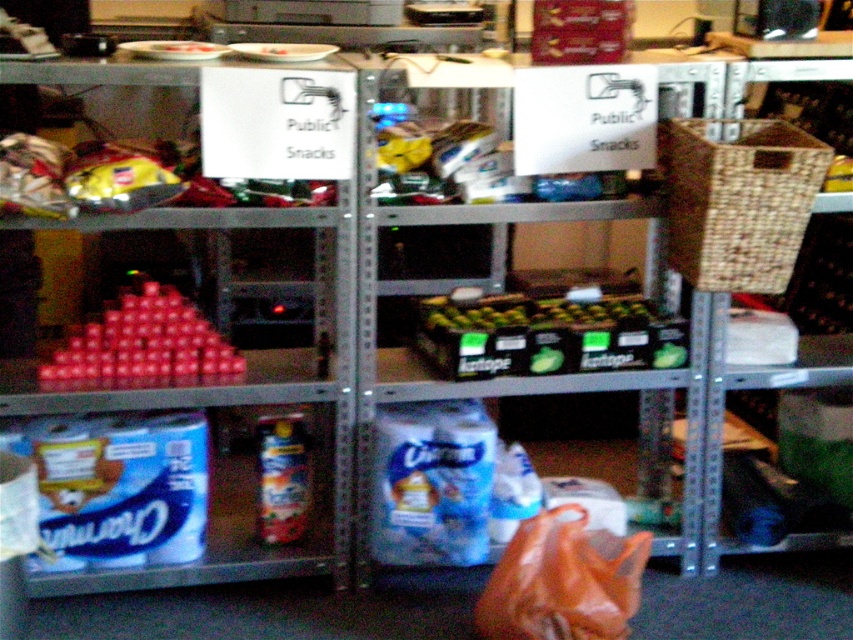
Can you confirm if orange plastic bag at lower center is positioned to the right of blue cardboard charmin at lower left?

Yes, orange plastic bag at lower center is to the right of blue cardboard charmin at lower left.

You are a GUI agent. You are given a task and a screenshot of the screen. Output one action in this format:
    pyautogui.click(x=<x>, y=<y>)
    Task: Click on the orange plastic bag at lower center
    This screenshot has height=640, width=853.
    Given the screenshot: What is the action you would take?
    pyautogui.click(x=561, y=580)

At what (x,y) coordinates should I click in order to perform the action: click on orange plastic bag at lower center. Please return your answer as a coordinate pair (x, y). The image size is (853, 640). Looking at the image, I should click on (561, 580).

I want to click on orange plastic bag at lower center, so click(x=561, y=580).

Which is in front, point (635, 582) or point (148, 374)?

Point (635, 582) is more forward.

Is orange plastic bag at lower center shorter than matte plastic cups at left?

In fact, orange plastic bag at lower center may be taller than matte plastic cups at left.

This screenshot has height=640, width=853. Describe the element at coordinates (561, 580) in the screenshot. I see `orange plastic bag at lower center` at that location.

This screenshot has width=853, height=640. What are the coordinates of `orange plastic bag at lower center` in the screenshot? It's located at (561, 580).

Does blue cardboard charmin at lower left have a smaller size compared to matte plastic cups at left?

No, blue cardboard charmin at lower left is not smaller than matte plastic cups at left.

Does blue cardboard charmin at lower left have a greater width compared to matte plastic cups at left?

Indeed, blue cardboard charmin at lower left has a greater width compared to matte plastic cups at left.

Who is more forward, (250, 529) or (167, 364)?

Positioned in front is point (167, 364).

Image resolution: width=853 pixels, height=640 pixels. I want to click on blue cardboard charmin at lower left, so click(223, 538).